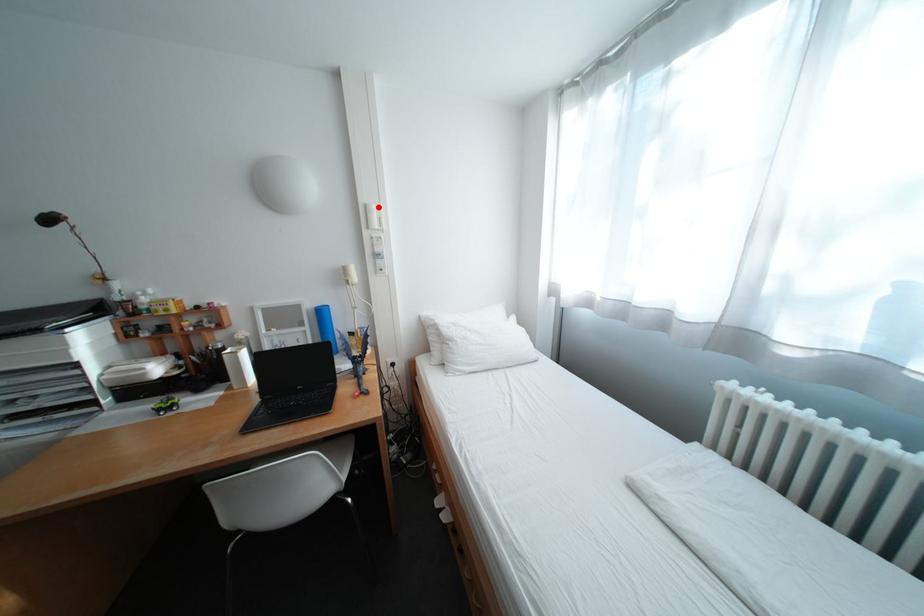
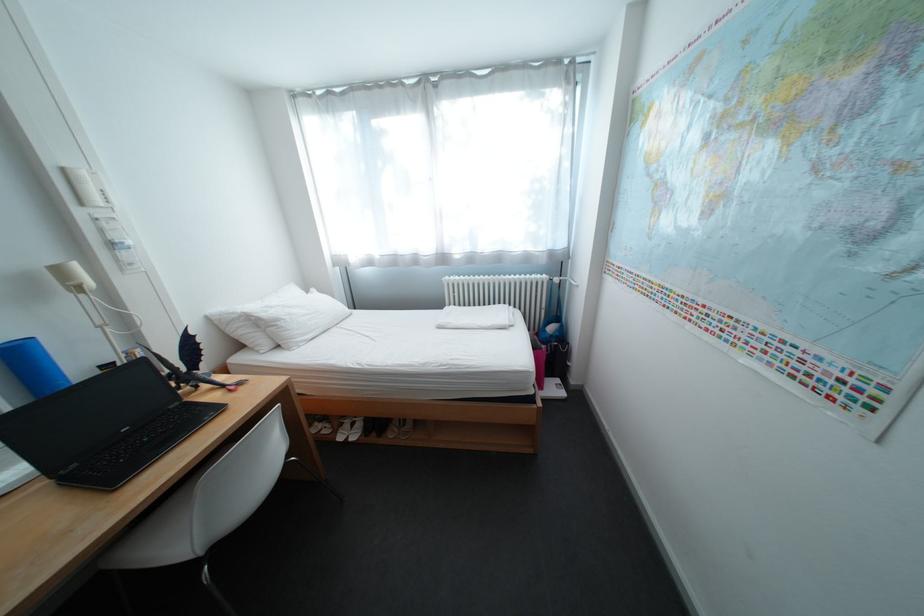
Question: I am providing you with two images of the same scene from different viewpoints. Image1 has a red point marked. In image2, the corresponding 3D location appears at what relative position? Reply with the corresponding letter.

Choices:
 (A) Closer
 (B) Farther

Answer: (B)